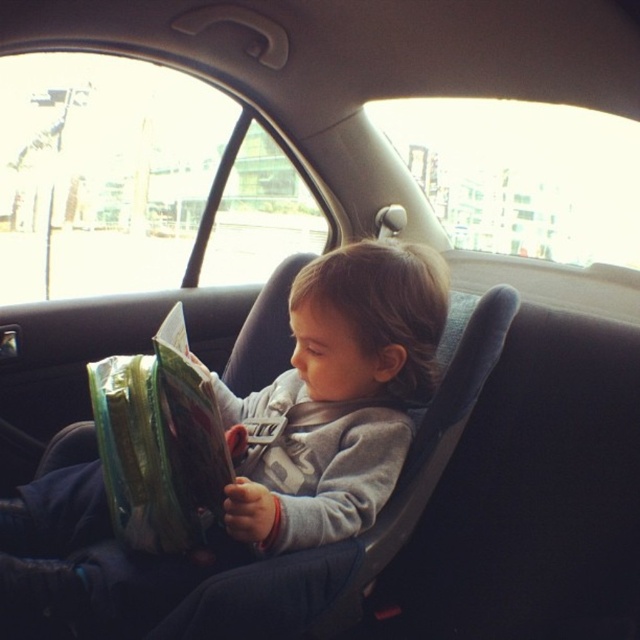
Question: Where is gray soft fabric toddler at center located in relation to green plastic bag at center in the image?

Choices:
 (A) below
 (B) above

Answer: (A)

Question: Which of the following is the closest to the observer?

Choices:
 (A) (131, 509)
 (B) (321, 307)

Answer: (A)

Question: Can you confirm if gray soft fabric toddler at center is positioned above green plastic bag at center?

Choices:
 (A) yes
 (B) no

Answer: (B)

Question: Can you confirm if gray soft fabric toddler at center is positioned to the right of green plastic bag at center?

Choices:
 (A) yes
 (B) no

Answer: (A)

Question: Which object appears closest to the camera in this image?

Choices:
 (A) gray soft fabric toddler at center
 (B) green plastic bag at center

Answer: (B)